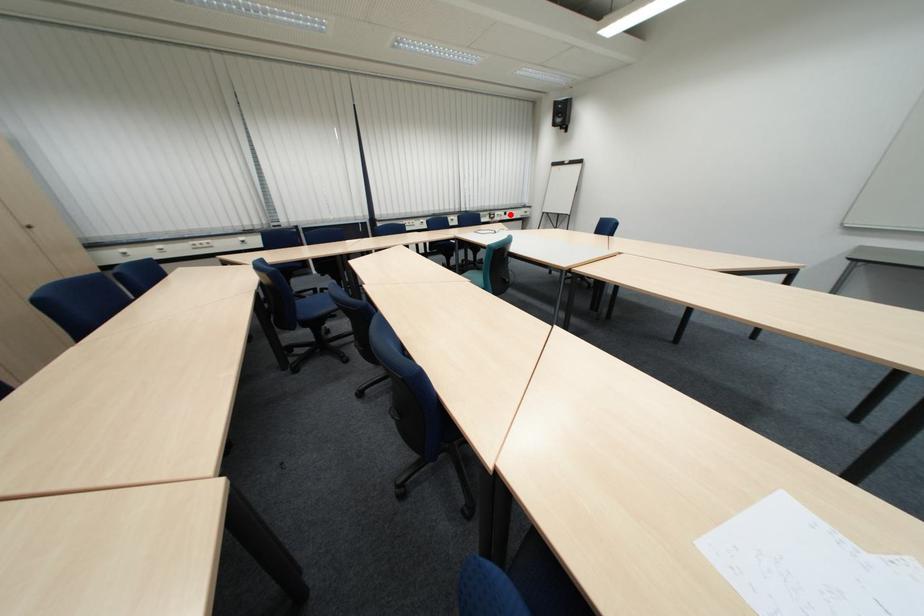
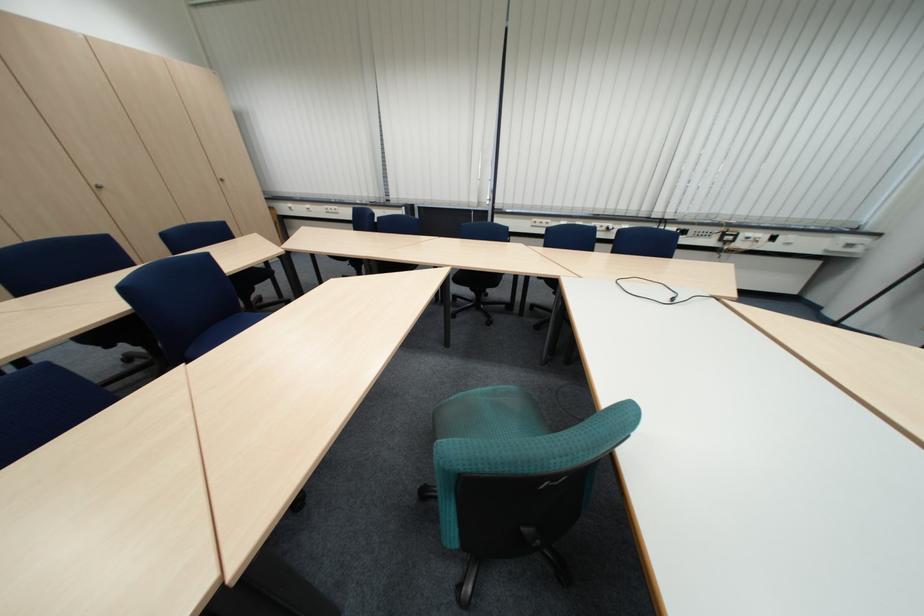
Where in the second image is the point corresponding to the highlighted location from the first image?

(759, 235)